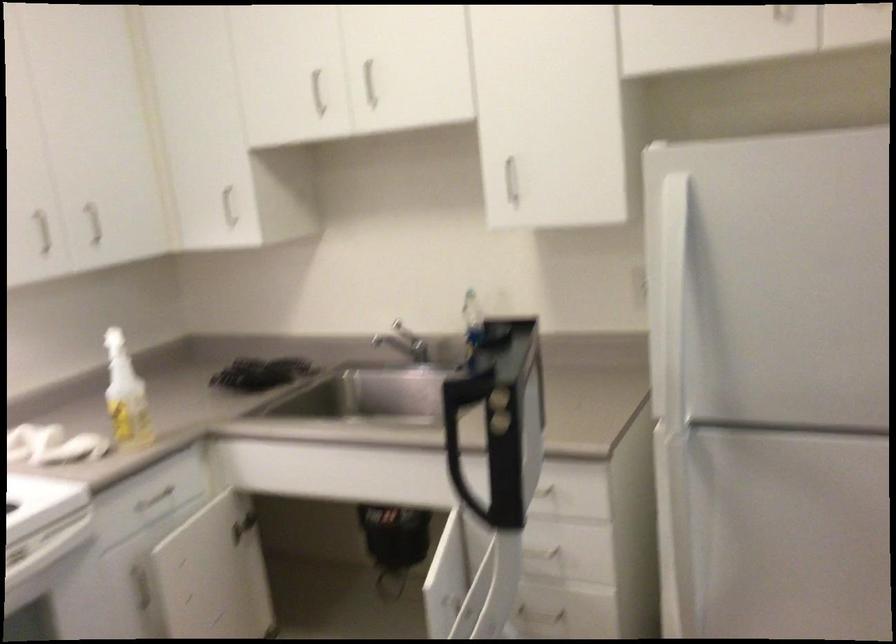
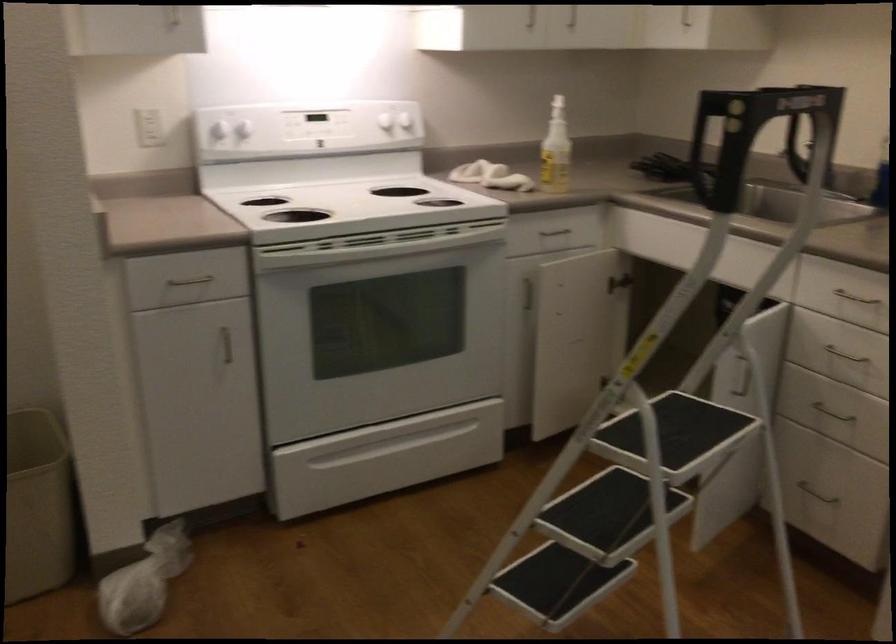
Find the pixel in the second image that matches [99,323] in the first image.

(557, 97)